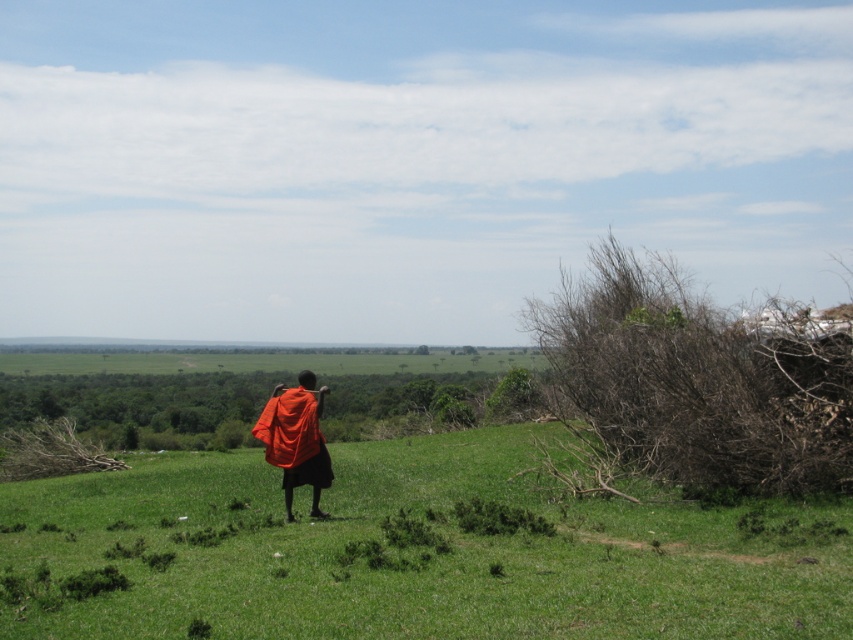
Question: Is green grassy at center wider than orange fabric shawl at center?

Choices:
 (A) yes
 (B) no

Answer: (A)

Question: Can you confirm if green grassy at center is bigger than orange fabric shawl at center?

Choices:
 (A) yes
 (B) no

Answer: (A)

Question: Does green grassy at center have a larger size compared to orange fabric shawl at center?

Choices:
 (A) no
 (B) yes

Answer: (B)

Question: Which of the following is the farthest from the observer?

Choices:
 (A) orange fabric shawl at center
 (B) green grassy at center

Answer: (A)

Question: Which point appears closest to the camera in this image?

Choices:
 (A) (303, 378)
 (B) (369, 532)

Answer: (B)